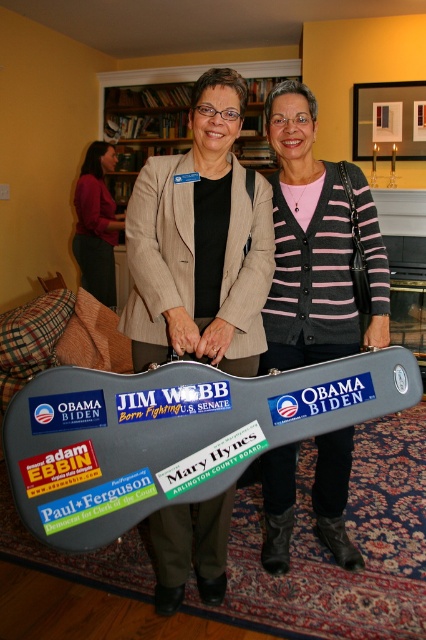
Question: Is matte gray guitar case at center to the right of dark red sweater at left from the viewer's perspective?

Choices:
 (A) no
 (B) yes

Answer: (B)

Question: Does gray plastic guitar case at center appear on the left side of dark red sweater at left?

Choices:
 (A) no
 (B) yes

Answer: (A)

Question: Which object is farther from the camera taking this photo?

Choices:
 (A) dark red sweater at left
 (B) wooden bookshelf at upper center

Answer: (B)

Question: Which object is the farthest from the matte gray guitar case at center?

Choices:
 (A) dark red sweater at left
 (B) pink striped sweater at center
 (C) gray plastic guitar case at center

Answer: (A)

Question: Which of these objects is positioned closest to the gray plastic guitar case at center?

Choices:
 (A) wooden bookshelf at upper center
 (B) matte gray guitar case at center
 (C) dark red sweater at left

Answer: (B)

Question: Does pink striped sweater at center have a lesser width compared to wooden bookshelf at upper center?

Choices:
 (A) yes
 (B) no

Answer: (A)